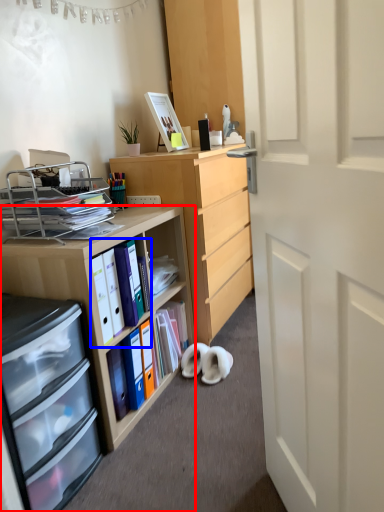
Question: Among these objects, which one is nearest to the camera, desk (highlighted by a red box) or book (highlighted by a blue box)?

Choices:
 (A) desk
 (B) book

Answer: (A)